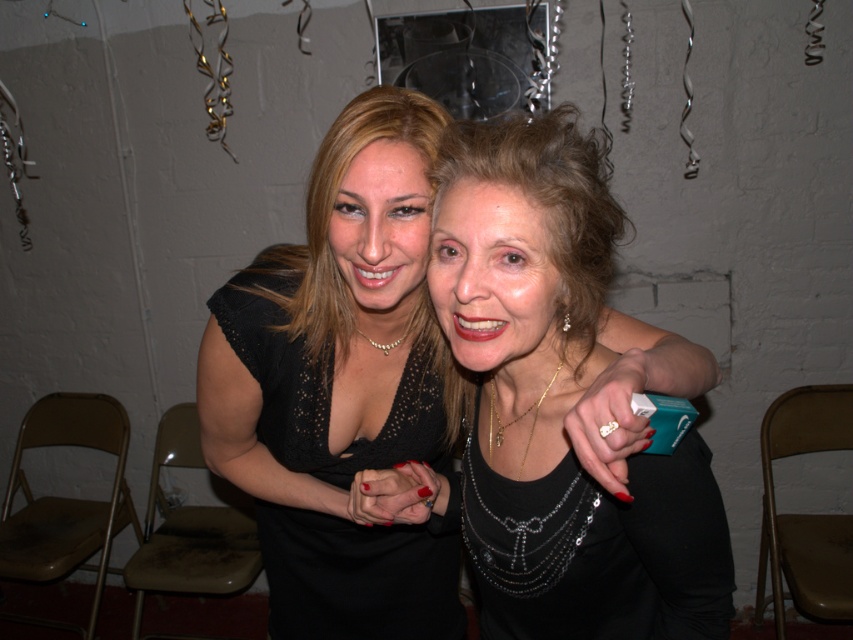
Question: From the image, what is the correct spatial relationship of black lace dress at center in relation to pearl necklace at center?

Choices:
 (A) above
 (B) below

Answer: (B)

Question: Does black satin dress at center come in front of pearl necklace at center?

Choices:
 (A) yes
 (B) no

Answer: (A)

Question: Which point appears farthest from the camera in this image?

Choices:
 (A) (389, 467)
 (B) (221, 412)
 (C) (381, 344)

Answer: (B)

Question: Among these points, which one is farthest from the camera?

Choices:
 (A) pos(405,324)
 (B) pos(309,305)

Answer: (A)

Question: Which of the following is the farthest from the observer?

Choices:
 (A) black lace dress at center
 (B) pearl necklace at center

Answer: (B)

Question: Is black lace dress at center positioned behind pearl necklace at center?

Choices:
 (A) no
 (B) yes

Answer: (A)